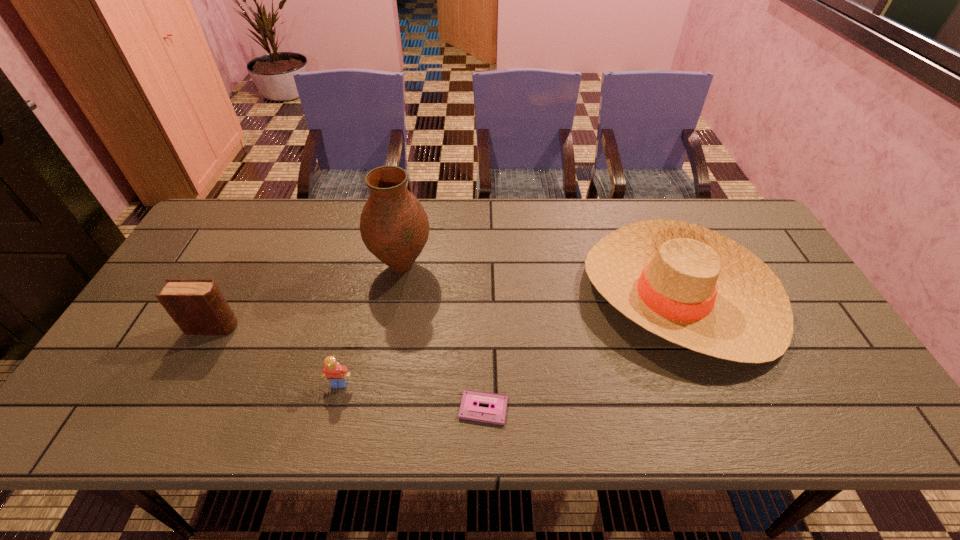
You are a GUI agent. You are given a task and a screenshot of the screen. Output one action in this format:
    pyautogui.click(x=<x>, y=<y>)
    Task: Click on the free space located 0.070m on the front-facing side of the second shortest object
    
    Given the screenshot: What is the action you would take?
    pyautogui.click(x=331, y=417)

The height and width of the screenshot is (540, 960). Find the location of `vacant space located 0.110m on the back of the shortest object`. vacant space located 0.110m on the back of the shortest object is located at coordinates (483, 352).

This screenshot has width=960, height=540. Identify the location of vase that is at the far edge. [394, 226].

Identify the location of sunhat situated at the far edge. The height and width of the screenshot is (540, 960). (692, 286).

This screenshot has height=540, width=960. What are the coordinates of `object that is at the near edge` in the screenshot? It's located at (468, 410).

Image resolution: width=960 pixels, height=540 pixels. Find the location of `object at the left edge`. object at the left edge is located at coordinates (197, 306).

I want to click on object that is at the right edge, so 692,286.

Where is `object that is at the far right corner`? The image size is (960, 540). object that is at the far right corner is located at coordinates (692, 286).

In the image, there is a desktop. Identify the location of vacant space at the far edge. The height and width of the screenshot is (540, 960). (448, 239).

Locate an element on the screen. vacant space at the near edge of the desktop is located at coordinates (450, 406).